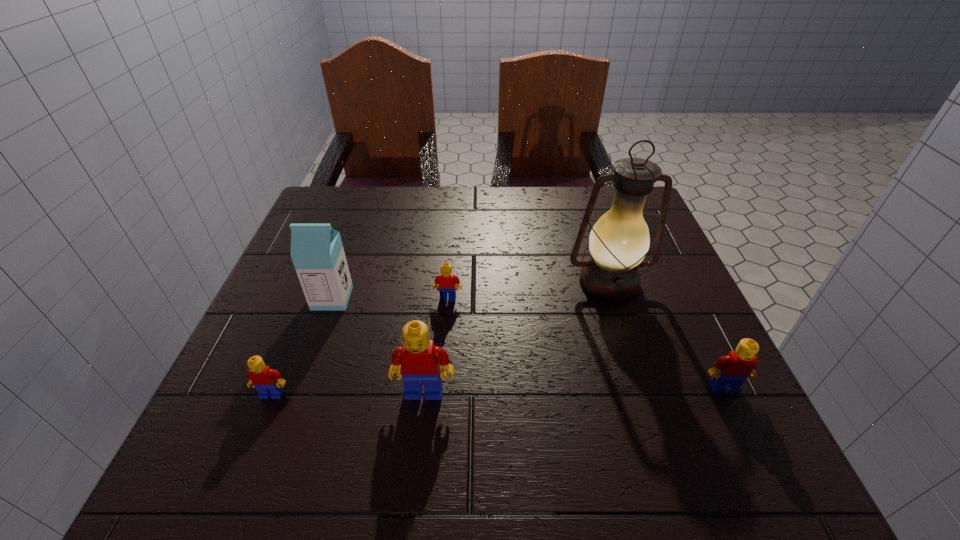
At what (x,y) coordinates should I click in order to perform the action: click on the leftmost Lego. Please return your answer as a coordinate pair (x, y). Looking at the image, I should click on (267, 382).

The height and width of the screenshot is (540, 960). I want to click on the tallest Lego, so click(x=420, y=360).

Find the location of a particular element. the second tallest Lego is located at coordinates pos(729,372).

This screenshot has width=960, height=540. Identify the location of the third shortest object. (729, 372).

Where is `the tallest object`? The height and width of the screenshot is (540, 960). the tallest object is located at coordinates (619, 240).

The height and width of the screenshot is (540, 960). I want to click on oil lamp, so click(619, 240).

Identify the location of the farthest Lego. (447, 281).

Find the location of `milk carton`. milk carton is located at coordinates (317, 252).

Locate an element on the screen. This screenshot has height=540, width=960. vacant space located 0.060m on the back of the tallest object is located at coordinates (596, 244).

Where is `free spot located on the face of the farthest Lego`? This screenshot has width=960, height=540. free spot located on the face of the farthest Lego is located at coordinates (439, 416).